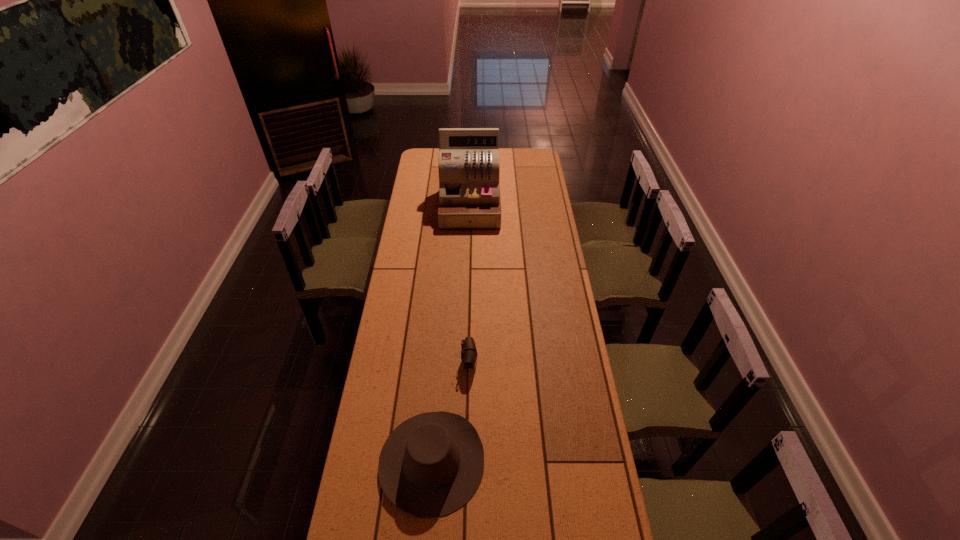
Identify the location of object that can be found as the second closest to the tallest object. This screenshot has height=540, width=960. (431, 465).

Find the location of a particular element. This screenshot has height=540, width=960. vacant area in the image that satisfies the following two spatial constraints: 1. with the flap open on the pouch; 2. on the front side of the second tallest object is located at coordinates (468, 461).